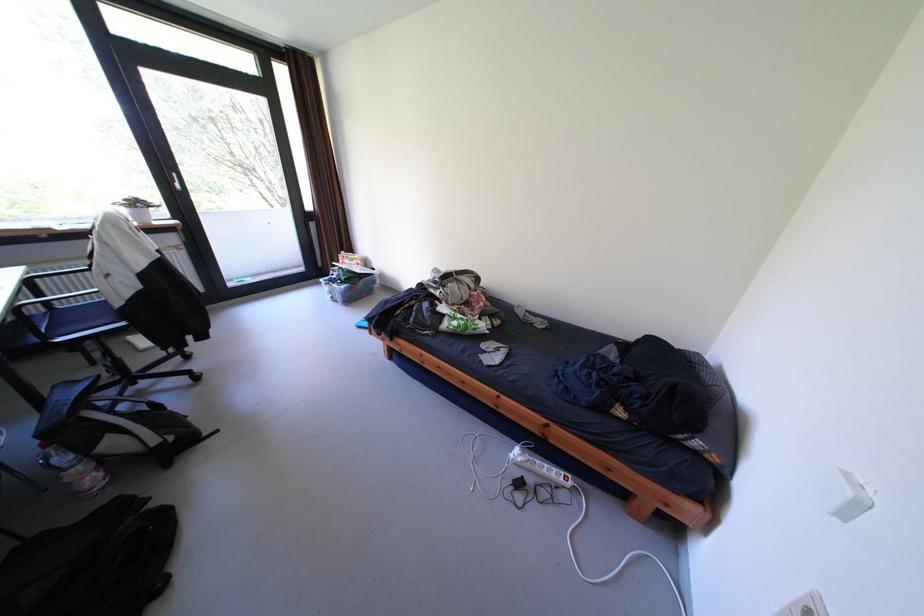
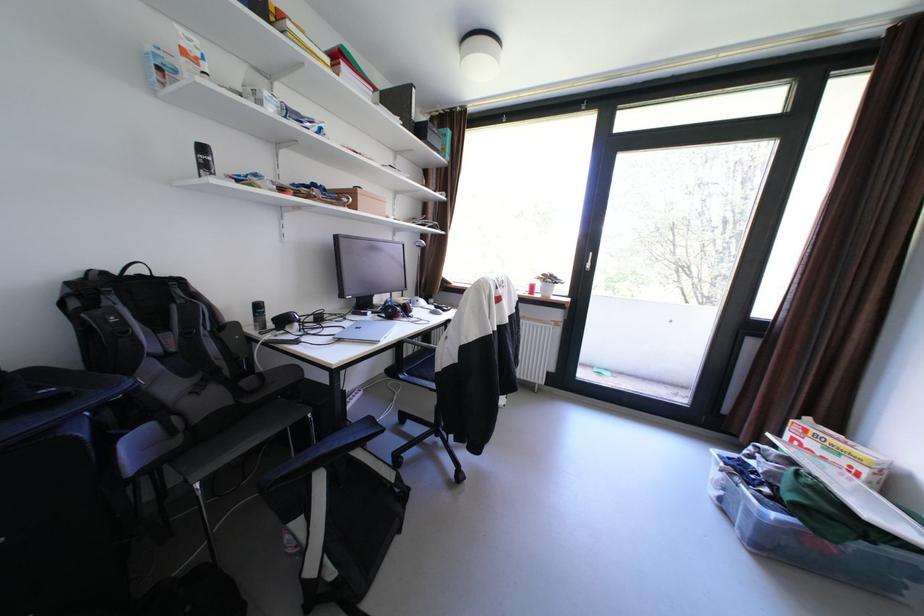
Locate, in the second image, the point that corresponds to point 354,286 in the first image.

(784, 516)